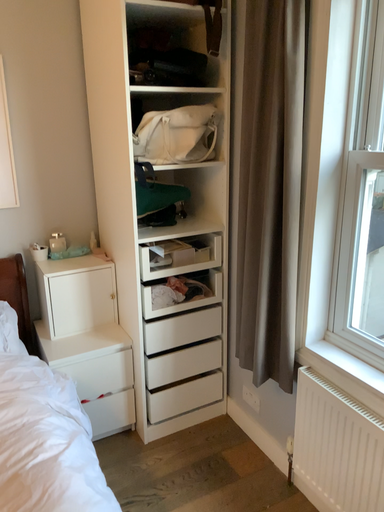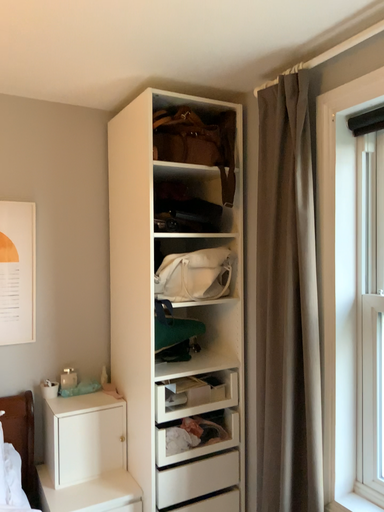
Question: How did the camera likely rotate when shooting the video?

Choices:
 (A) rotated upward
 (B) rotated downward

Answer: (A)